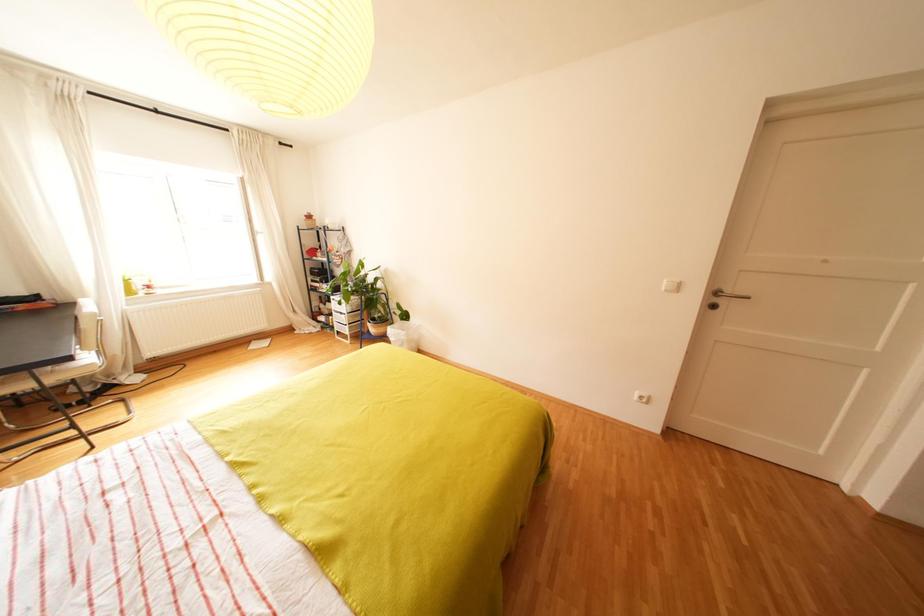
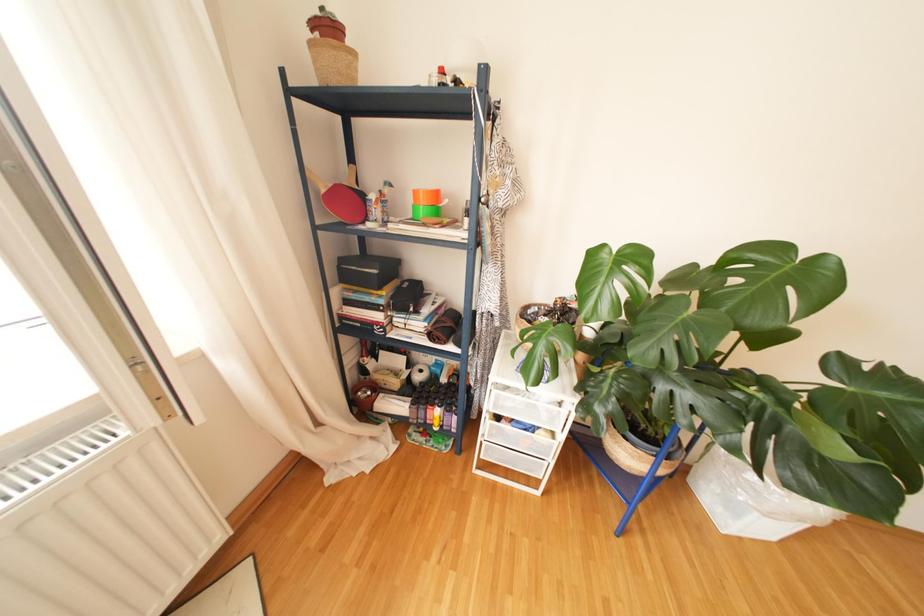
In a continuous first-person perspective shot, in which direction is the camera moving?

The movement direction of the cameraman is left, forward.